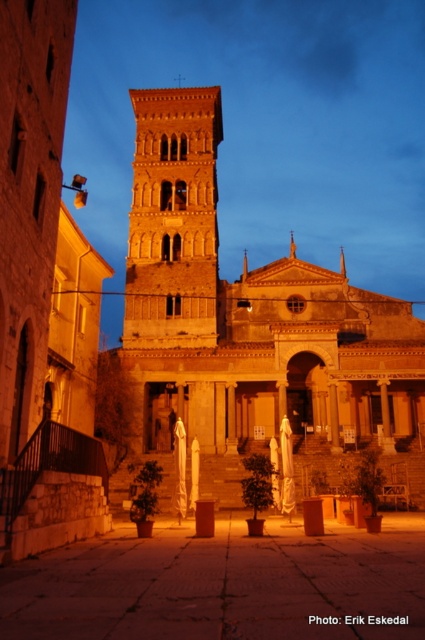
You are standing in the courtyard of the historical building and want to take a photo. There are two points marked in the image at coordinates point (371, 340) and point (130, 275). Which point is closer to your current position?

Point (371, 340) is closer to the camera than point (130, 275), so the point (371, 340) is closer to your current position.

In the scene shown: You are standing in the courtyard of the golden stone church at center. If you face the building, which direction should you walk to reach the entrance?

Since the golden stone church at center is positioned at point coordinates, you should walk towards the front of the building to reach the entrance.